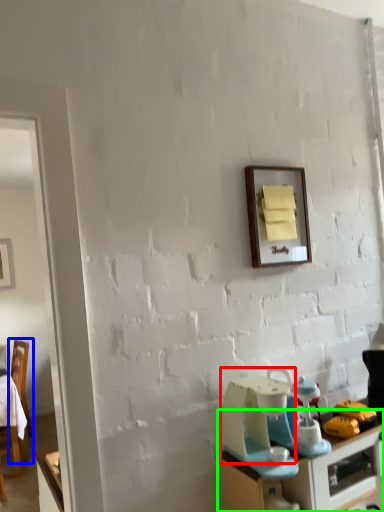
Question: Which object is the closest to the appliance (highlighted by a red box)? Choose among these: chair (highlighted by a blue box) or desk (highlighted by a green box).

Choices:
 (A) chair
 (B) desk

Answer: (B)